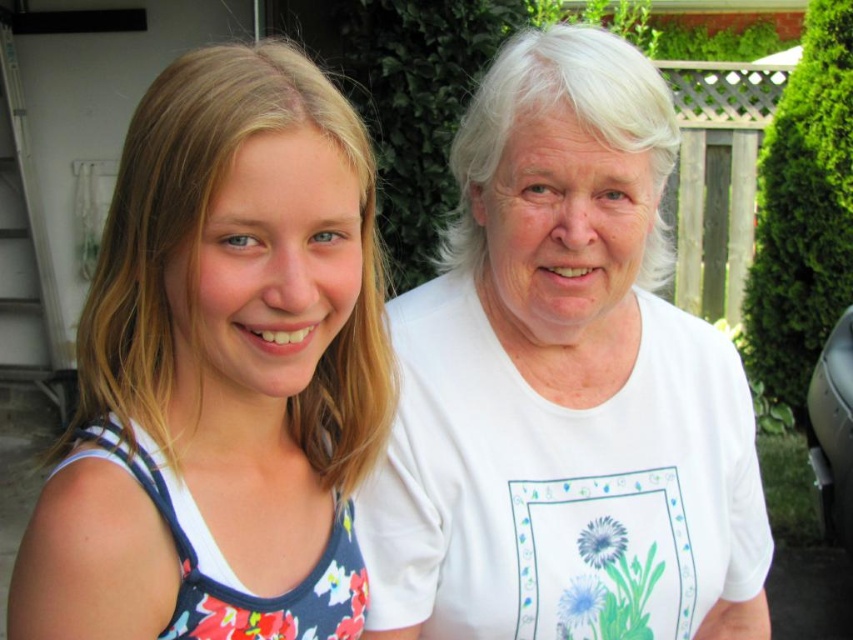
Is floral fabric dress at left above floral fabric tank top at left?

Yes.

Find the location of a particular element. This screenshot has height=640, width=853. floral fabric dress at left is located at coordinates (221, 371).

Where is `floral fabric dress at left`? The image size is (853, 640). floral fabric dress at left is located at coordinates (221, 371).

Which of these two, white cotton t-shirt at upper right or floral fabric tank top at left, stands taller?

Standing taller between the two is white cotton t-shirt at upper right.

Can you confirm if white cotton t-shirt at upper right is positioned to the right of floral fabric tank top at left?

Indeed, white cotton t-shirt at upper right is positioned on the right side of floral fabric tank top at left.

Does point (570, 388) come closer to viewer compared to point (181, 556)?

No, (570, 388) is behind (181, 556).

The image size is (853, 640). What are the coordinates of `white cotton t-shirt at upper right` in the screenshot? It's located at (563, 387).

Which is more to the left, white cotton t-shirt at upper right or floral fabric dress at left?

floral fabric dress at left

Is point (679, 353) closer to viewer compared to point (192, 157)?

No, (679, 353) is further to viewer.

Where is `white cotton t-shirt at upper right`? The width and height of the screenshot is (853, 640). white cotton t-shirt at upper right is located at coordinates (563, 387).